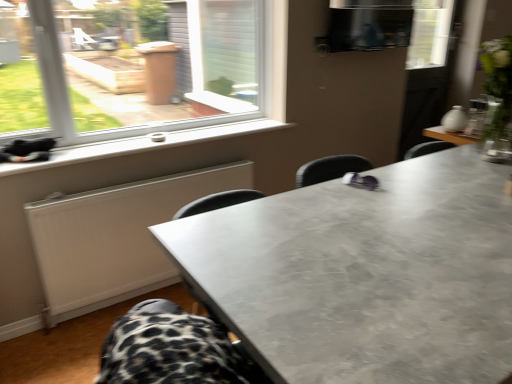
Question: Is white matte radiator at lower left situated inside white plastic window sill at lower left or outside?

Choices:
 (A) inside
 (B) outside

Answer: (B)

Question: Relative to white plastic window sill at lower left, is white matte radiator at lower left in front or behind?

Choices:
 (A) front
 (B) behind

Answer: (B)

Question: Which object is positioned farthest from the white plastic window sill at lower left?

Choices:
 (A) matte gray table at center
 (B) white matte radiator at lower left

Answer: (A)

Question: Which of these objects is positioned farthest from the white plastic window sill at lower left?

Choices:
 (A) matte gray table at center
 (B) white matte radiator at lower left

Answer: (A)